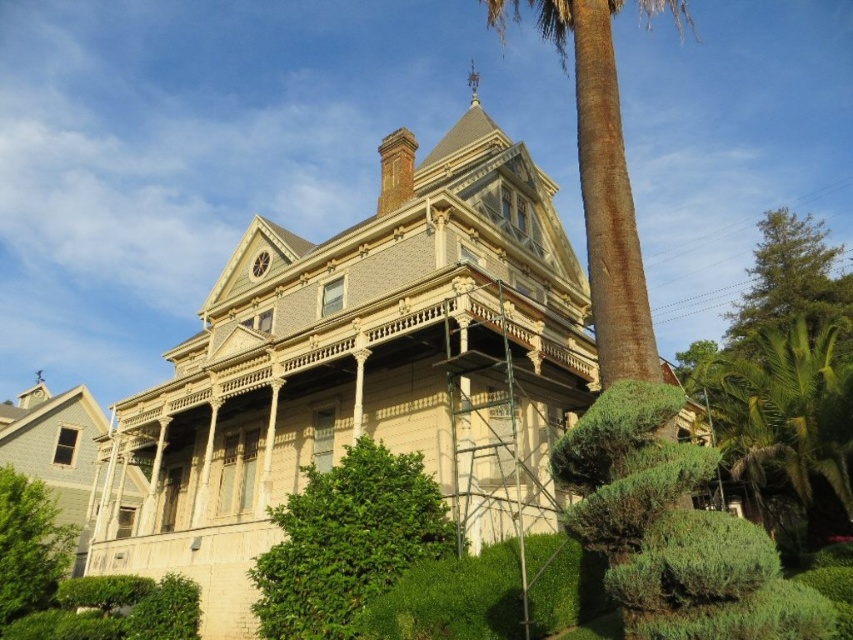
You are standing in front of the Victorian house and want to place a decorative statue between the green leafy bush at lower center and the brown textured palm tree at center. Based on their positions, which side of the palm tree should the statue be placed on?

The green leafy bush at lower center is to the left of the brown textured palm tree at center, so the statue should be placed to the left side of the brown textured palm tree at center to position it between them.

You are standing in front of the Victorian house and want to place a small garden statue. The statue requires a spot that is not under any trees or bushes. Based on the scene, is the area between the green leafy bush at lower center and the brown textured palm tree at center suitable?

The green leafy bush at lower center is below the brown textured palm tree at center, so the area between them may still be under the palm tree. Check if the statue can be placed outside of both the green leafy bush at lower center and the brown textured palm tree at center for an open space.